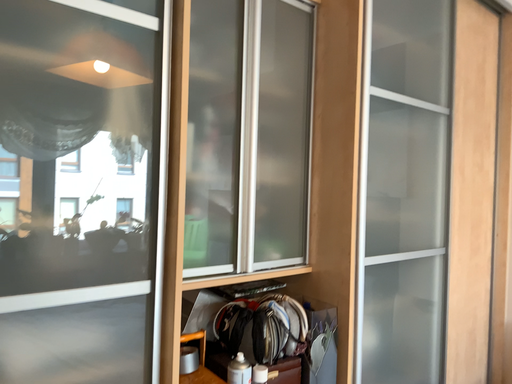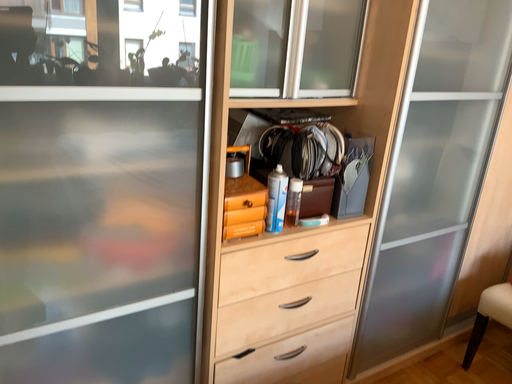
Question: How did the camera likely rotate when shooting the video?

Choices:
 (A) rotated right
 (B) rotated left

Answer: (B)